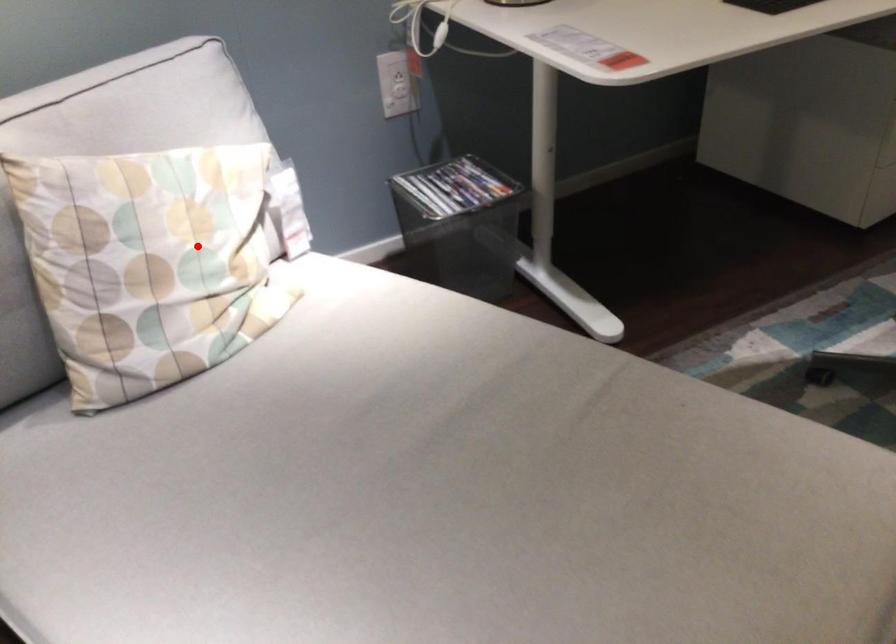
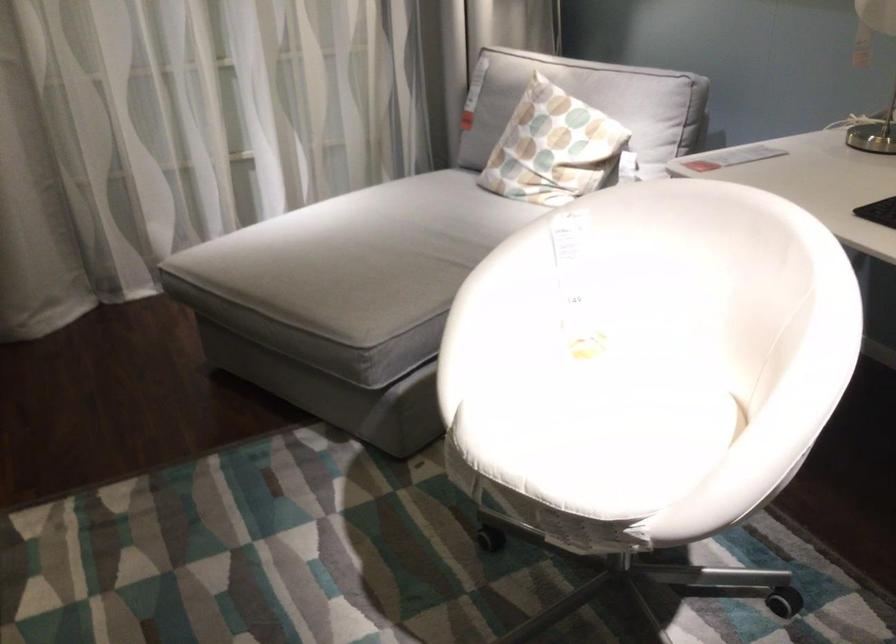
Where in the second image is the point corresponding to the highlighted location from the first image?

(553, 147)